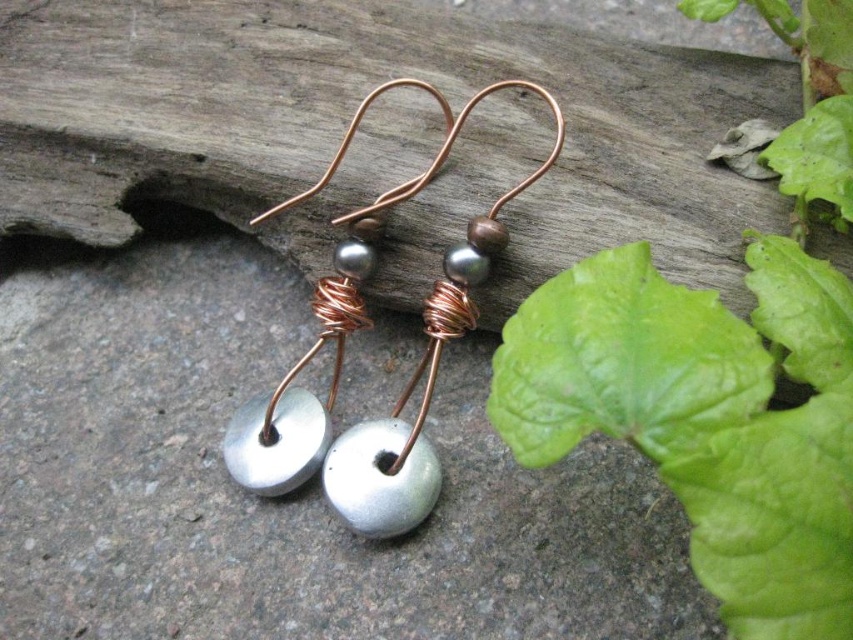
Question: Which point appears farthest from the camera in this image?

Choices:
 (A) (469, 298)
 (B) (395, 458)

Answer: (A)

Question: Can you confirm if matte silver bead at center is positioned to the right of metallic silver bead at center?

Choices:
 (A) no
 (B) yes

Answer: (A)

Question: Is the position of matte silver bead at center more distant than that of metallic silver bead at center?

Choices:
 (A) no
 (B) yes

Answer: (A)

Question: Among these objects, which one is nearest to the camera?

Choices:
 (A) matte silver bead at center
 (B) metallic silver bead at center

Answer: (A)

Question: Can you confirm if matte silver bead at center is smaller than metallic silver bead at center?

Choices:
 (A) no
 (B) yes

Answer: (A)

Question: Which point is closer to the camera?

Choices:
 (A) matte silver bead at center
 (B) metallic silver bead at center

Answer: (A)